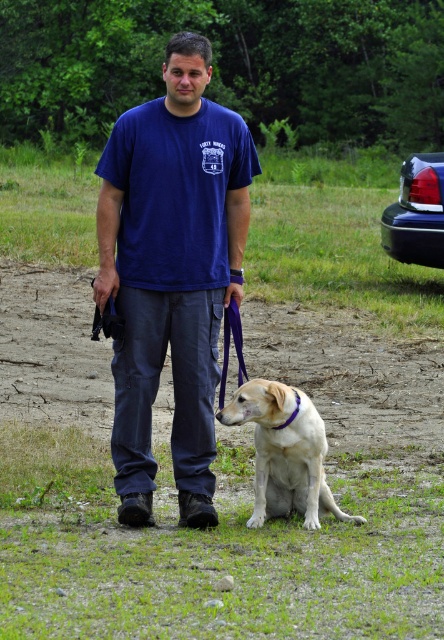
You are a photographer trying to capture a photo of the light brown fur at center and the glossy plastic car at upper right. Which object should you focus on first if you want to ensure both are in sharp focus?

The light brown fur at center is located below the glossy plastic car at upper right, so you should focus on the glossy plastic car at upper right first to ensure both are in sharp focus.